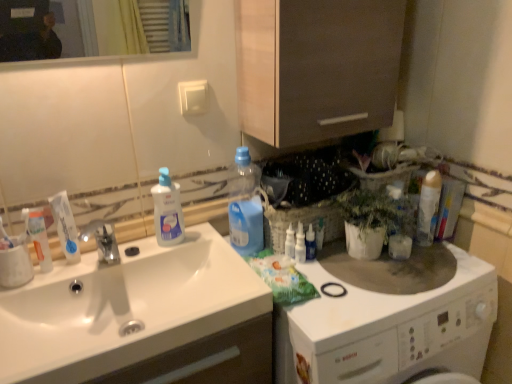
This screenshot has height=384, width=512. I want to click on free point above white glossy washing machine at right (from a real-world perspective), so click(x=374, y=282).